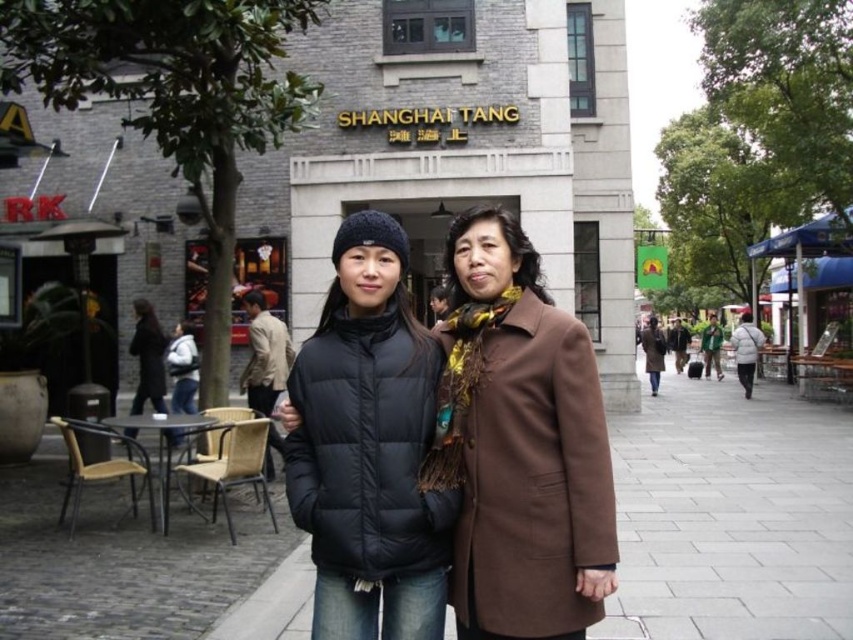
Describe the element at coordinates (519, 444) in the screenshot. I see `matte black coat at center` at that location.

Is matte black coat at center above white matte jacket at center?

No, matte black coat at center is not above white matte jacket at center.

Does point (519, 307) come closer to viewer compared to point (746, 381)?

Yes, point (519, 307) is in front of point (746, 381).

Identify the location of matte black coat at center. The image size is (853, 640). (519, 444).

Is matte black coat at center closer to camera compared to brown wool coat at center?

Yes, it is.

Which is in front, point (469, 433) or point (654, 390)?

Point (469, 433)

Which is in front, point (535, 282) or point (650, 314)?

Point (535, 282) is more forward.

Locate an element on the screen. This screenshot has height=640, width=853. matte black coat at center is located at coordinates (519, 444).

Consider the image. Between green fabric jacket at center and black matte jacket at center, which one has less height?

black matte jacket at center is shorter.

Does green fabric jacket at center have a greater width compared to black matte jacket at center?

Yes.

You are a GUI agent. You are given a task and a screenshot of the screen. Output one action in this format:
    pyautogui.click(x=<x>, y=<y>)
    Task: Click on the green fabric jacket at center
    The width and height of the screenshot is (853, 640).
    Given the screenshot: What is the action you would take?
    pyautogui.click(x=711, y=346)